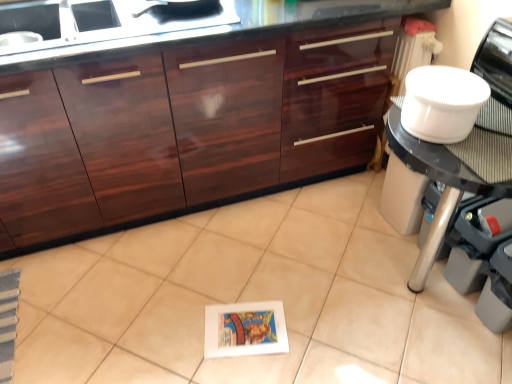
Question: Is white glossy tile at center closer to camera compared to white plastic bowl at right?

Choices:
 (A) no
 (B) yes

Answer: (B)

Question: From a real-world perspective, is white glossy tile at center under white plastic bowl at right?

Choices:
 (A) yes
 (B) no

Answer: (A)

Question: Is white glossy tile at center smaller than white plastic bowl at right?

Choices:
 (A) yes
 (B) no

Answer: (B)

Question: Is white glossy tile at center taller than white plastic bowl at right?

Choices:
 (A) yes
 (B) no

Answer: (B)

Question: Are white glossy tile at center and white plastic bowl at right located far from each other?

Choices:
 (A) no
 (B) yes

Answer: (A)

Question: Can you confirm if white glossy tile at center is bigger than white plastic bowl at right?

Choices:
 (A) yes
 (B) no

Answer: (A)

Question: Considering the relative positions of glossy wood cabinetry at center and white plastic bowl at upper right in the image provided, is glossy wood cabinetry at center behind white plastic bowl at upper right?

Choices:
 (A) no
 (B) yes

Answer: (B)

Question: Considering the relative sizes of glossy wood cabinetry at center and white plastic bowl at upper right in the image provided, is glossy wood cabinetry at center thinner than white plastic bowl at upper right?

Choices:
 (A) no
 (B) yes

Answer: (A)

Question: Is the position of glossy wood cabinetry at center less distant than that of white plastic bowl at upper right?

Choices:
 (A) no
 (B) yes

Answer: (A)

Question: From the image's perspective, is glossy wood cabinetry at center beneath white plastic bowl at upper right?

Choices:
 (A) no
 (B) yes

Answer: (A)

Question: Considering the relative positions of glossy wood cabinetry at center and white plastic bowl at upper right in the image provided, is glossy wood cabinetry at center to the right of white plastic bowl at upper right from the viewer's perspective?

Choices:
 (A) no
 (B) yes

Answer: (A)

Question: Is glossy wood cabinetry at center not near white plastic bowl at upper right?

Choices:
 (A) yes
 (B) no

Answer: (B)

Question: From a real-world perspective, is glossy wood cabinetry at center located beneath white glossy tile at center?

Choices:
 (A) no
 (B) yes

Answer: (A)